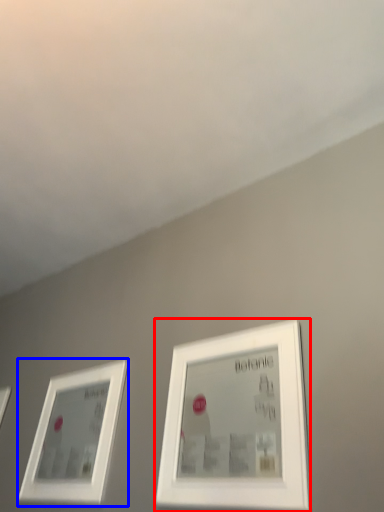
Question: Which object is further to the camera taking this photo, picture frame (highlighted by a red box) or picture frame (highlighted by a blue box)?

Choices:
 (A) picture frame
 (B) picture frame

Answer: (B)